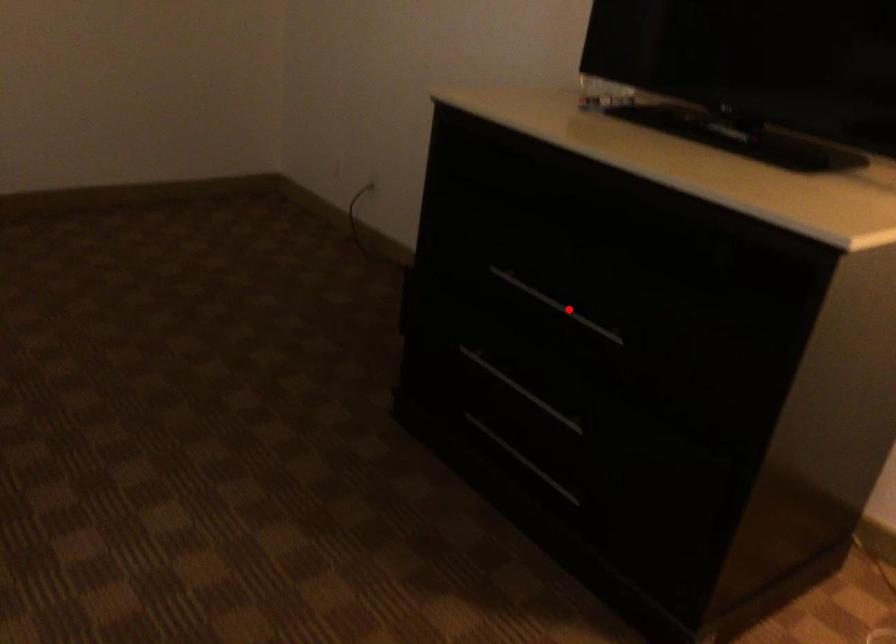
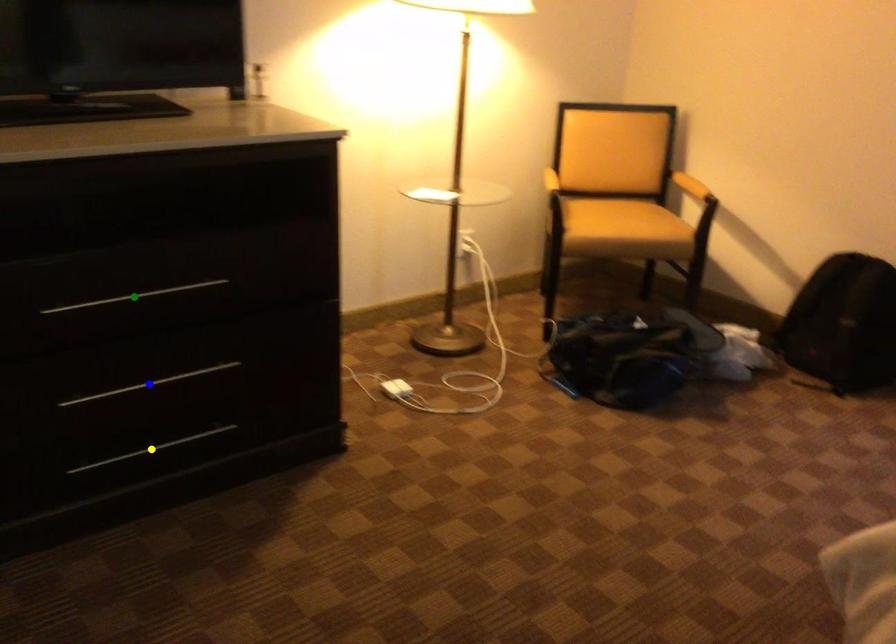
Question: I am providing you with two images of the same scene from different viewpoints. A red point is marked on the first image. You are given multiple points on the second image. Which point in image 2 is actually the same real-world point as the red point in image 1?

Choices:
 (A) yellow point
 (B) green point
 (C) blue point

Answer: (B)